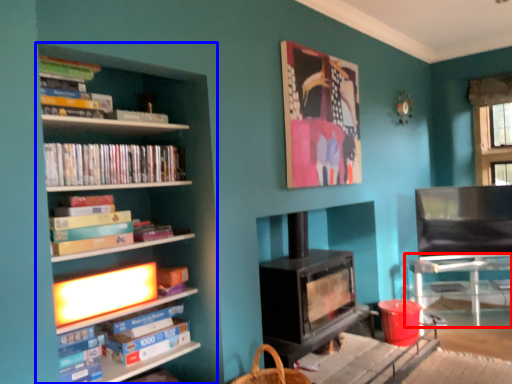
Question: Which object appears farthest to the camera in this image, table (highlighted by a red box) or shelf (highlighted by a blue box)?

Choices:
 (A) table
 (B) shelf

Answer: (A)